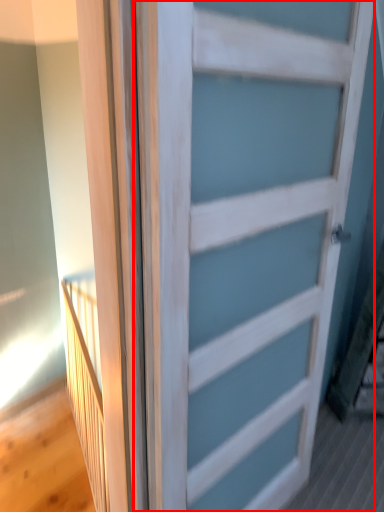
Question: From the image's perspective, where is door (annotated by the red box) located in relation to elevator in the image?

Choices:
 (A) below
 (B) above

Answer: (B)